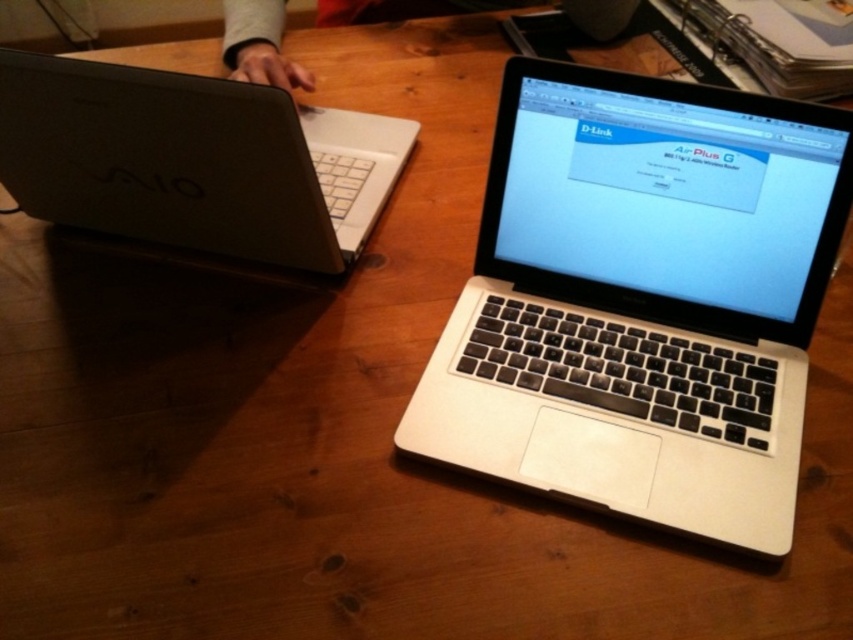
Question: Estimate the real-world distances between objects in this image. Which object is closer to the silver/black keyboard at center?

Choices:
 (A) skinny jeans at upper center
 (B) matte black laptop at left

Answer: (B)

Question: Based on their relative distances, which object is nearer to the skinny jeans at upper center?

Choices:
 (A) matte black laptop at left
 (B) silver/black keyboard at center

Answer: (A)

Question: Is the position of silver/black keyboard at center more distant than that of skinny jeans at upper center?

Choices:
 (A) no
 (B) yes

Answer: (A)

Question: Is matte black laptop at left below skinny jeans at upper center?

Choices:
 (A) no
 (B) yes

Answer: (B)

Question: From the image, what is the correct spatial relationship of matte black laptop at left in relation to skinny jeans at upper center?

Choices:
 (A) above
 (B) below

Answer: (B)

Question: Which point is closer to the camera?

Choices:
 (A) matte black laptop at left
 (B) silver/black keyboard at center
 (C) skinny jeans at upper center

Answer: (B)